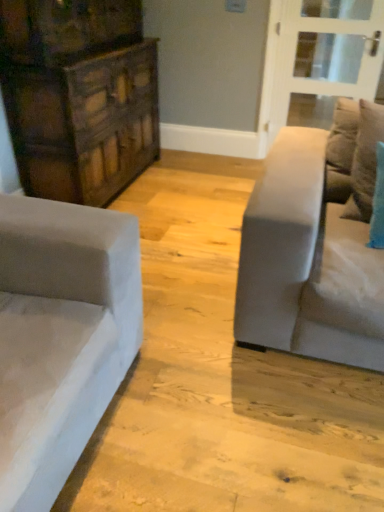
Question: Should I look upward or downward to see velvet teal pillow at right?

Choices:
 (A) up
 (B) down

Answer: (A)

Question: Is light gray fabric couch at right beside velvet teal pillow at right?

Choices:
 (A) yes
 (B) no

Answer: (B)

Question: Does light gray fabric couch at right have a smaller size compared to velvet teal pillow at right?

Choices:
 (A) no
 (B) yes

Answer: (A)

Question: Does light gray fabric couch at right contain velvet teal pillow at right?

Choices:
 (A) no
 (B) yes

Answer: (B)

Question: Does light gray fabric couch at right have a greater height compared to velvet teal pillow at right?

Choices:
 (A) no
 (B) yes

Answer: (B)

Question: From a real-world perspective, is light gray fabric couch at right on top of velvet teal pillow at right?

Choices:
 (A) yes
 (B) no

Answer: (B)

Question: From the image's perspective, is light gray fabric couch at right located above velvet teal pillow at right?

Choices:
 (A) yes
 (B) no

Answer: (B)

Question: Does velvet teal pillow at right come in front of clear glass door at upper right?

Choices:
 (A) yes
 (B) no

Answer: (A)

Question: Considering the relative sizes of velvet teal pillow at right and clear glass door at upper right in the image provided, is velvet teal pillow at right wider than clear glass door at upper right?

Choices:
 (A) no
 (B) yes

Answer: (B)

Question: Is velvet teal pillow at right not near clear glass door at upper right?

Choices:
 (A) no
 (B) yes

Answer: (B)

Question: From a real-world perspective, is velvet teal pillow at right located beneath clear glass door at upper right?

Choices:
 (A) no
 (B) yes

Answer: (A)

Question: Is velvet teal pillow at right thinner than clear glass door at upper right?

Choices:
 (A) no
 (B) yes

Answer: (A)

Question: Is velvet teal pillow at right next to clear glass door at upper right and touching it?

Choices:
 (A) yes
 (B) no

Answer: (B)

Question: From the image's perspective, is velvet teal pillow at right beneath dark wood dresser at left?

Choices:
 (A) yes
 (B) no

Answer: (A)